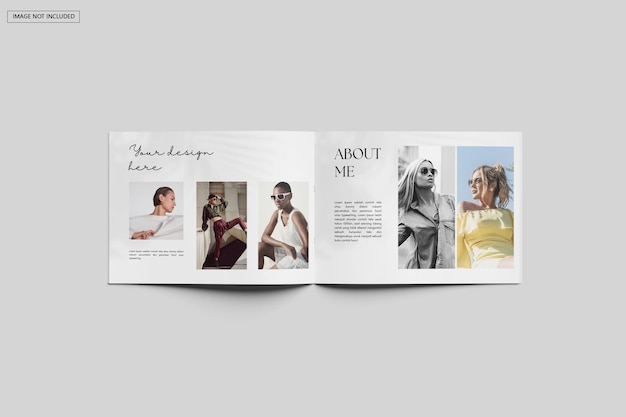
The height and width of the screenshot is (417, 626). Find the location of `square photo`. square photo is located at coordinates (144, 201).